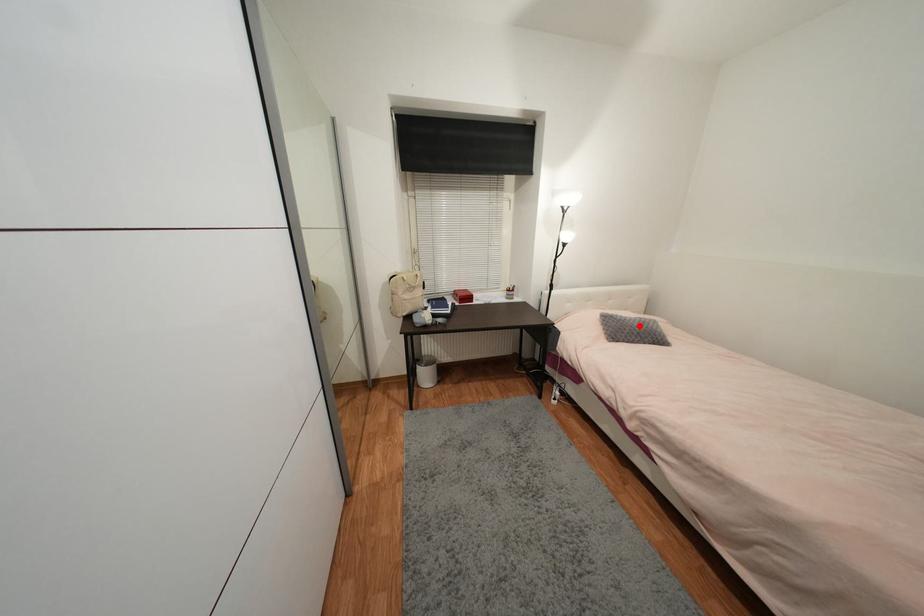
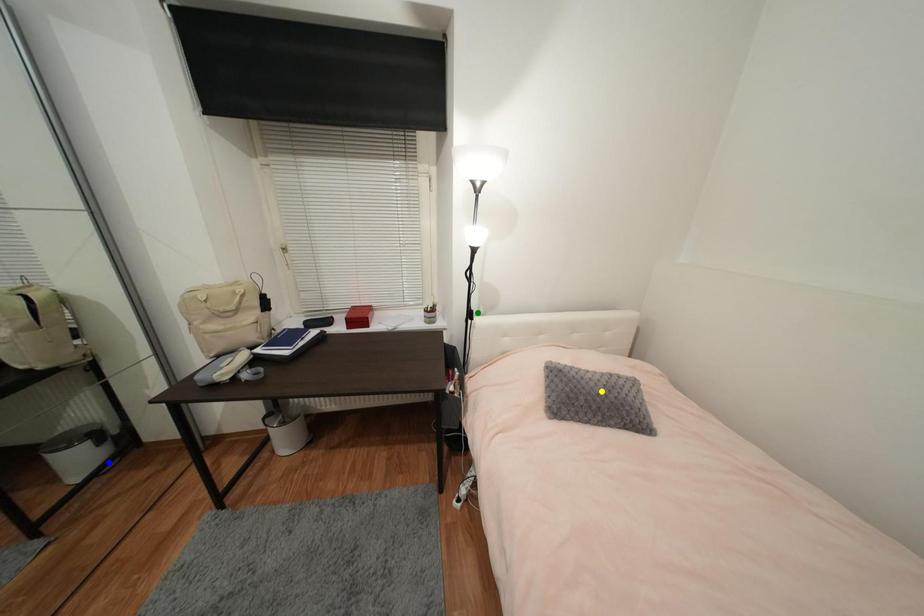
Question: I am providing you with two images of the same scene from different viewpoints. A red point is marked on the first image. You are given multiple points on the second image. Which point in image 2 represents the same 3d spot as the red point in image 1?

Choices:
 (A) blue point
 (B) yellow point
 (C) green point

Answer: (B)